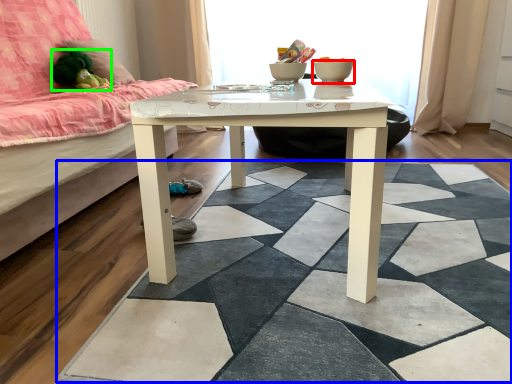
Question: Considering the real-world distances, which object is closest to glass bowl (highlighted by a red box)? square (highlighted by a blue box) or toy (highlighted by a green box).

Choices:
 (A) square
 (B) toy

Answer: (A)